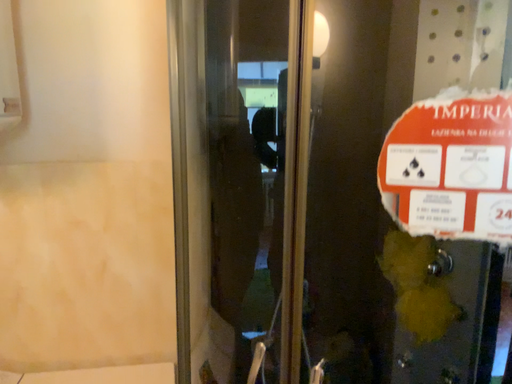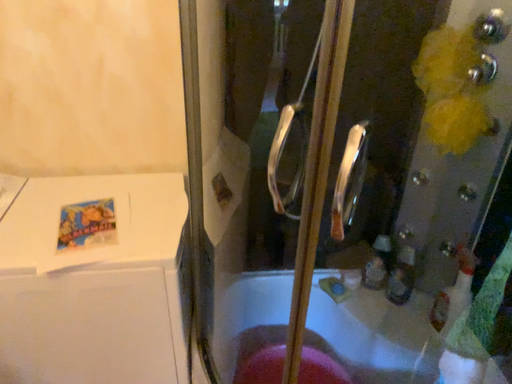
Question: Which way did the camera rotate in the video?

Choices:
 (A) rotated downward
 (B) rotated upward

Answer: (A)